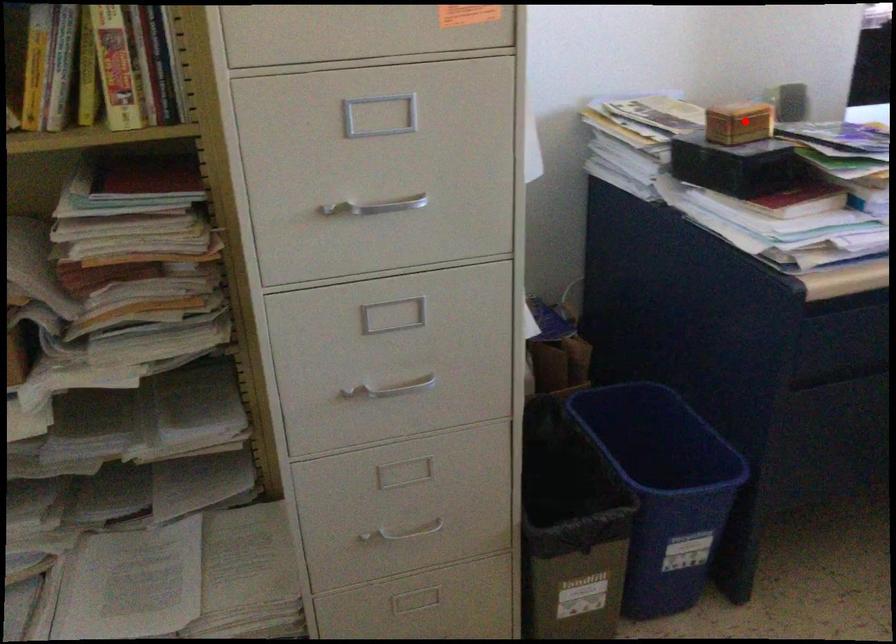
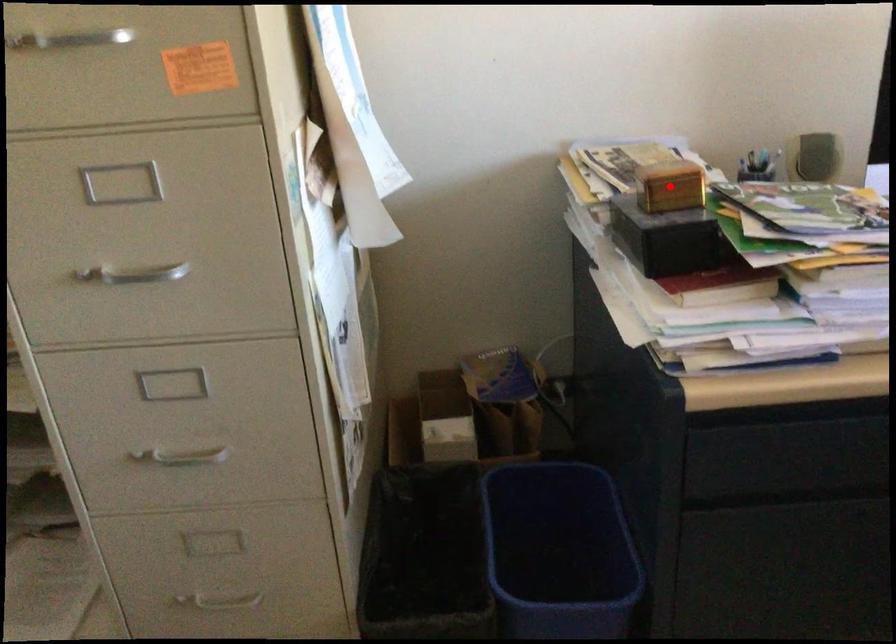
I am providing you with two images of the same scene from different viewpoints. A red point is marked on the first image and another point is marked on the second image. Is the marked point in image1 the same physical position as the marked point in image2?

Yes